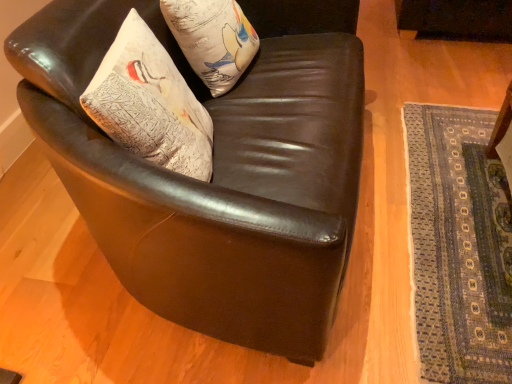
Question: Considering the relative positions of shiny brown leather armchair at center and textured white pillow at upper left in the image provided, is shiny brown leather armchair at center to the left of textured white pillow at upper left from the viewer's perspective?

Choices:
 (A) yes
 (B) no

Answer: (B)

Question: Considering the relative sizes of shiny brown leather armchair at center and textured white pillow at upper left in the image provided, is shiny brown leather armchair at center shorter than textured white pillow at upper left?

Choices:
 (A) yes
 (B) no

Answer: (B)

Question: From the image's perspective, would you say shiny brown leather armchair at center is shown under textured white pillow at upper left?

Choices:
 (A) yes
 (B) no

Answer: (B)

Question: Can you confirm if shiny brown leather armchair at center is taller than textured white pillow at upper left?

Choices:
 (A) yes
 (B) no

Answer: (A)

Question: Are shiny brown leather armchair at center and textured white pillow at upper left located far from each other?

Choices:
 (A) no
 (B) yes

Answer: (A)

Question: From a real-world perspective, is shiny brown leather armchair at center on textured white pillow at upper left?

Choices:
 (A) yes
 (B) no

Answer: (B)

Question: Can you confirm if textured white pillow at upper left is taller than textured white pillow at upper left?

Choices:
 (A) no
 (B) yes

Answer: (A)

Question: Is textured white pillow at upper left not near textured white pillow at upper left?

Choices:
 (A) no
 (B) yes

Answer: (A)

Question: Considering the relative positions of textured white pillow at upper left and textured white pillow at upper left in the image provided, is textured white pillow at upper left to the left of textured white pillow at upper left from the viewer's perspective?

Choices:
 (A) no
 (B) yes

Answer: (A)

Question: Is textured white pillow at upper left thinner than textured white pillow at upper left?

Choices:
 (A) no
 (B) yes

Answer: (A)

Question: Is textured white pillow at upper left at the right side of textured white pillow at upper left?

Choices:
 (A) no
 (B) yes

Answer: (B)

Question: From a real-world perspective, is textured white pillow at upper left positioned under textured white pillow at upper left based on gravity?

Choices:
 (A) yes
 (B) no

Answer: (A)

Question: From the image's perspective, is textured white pillow at upper left on textured white pillow at upper left?

Choices:
 (A) no
 (B) yes

Answer: (A)